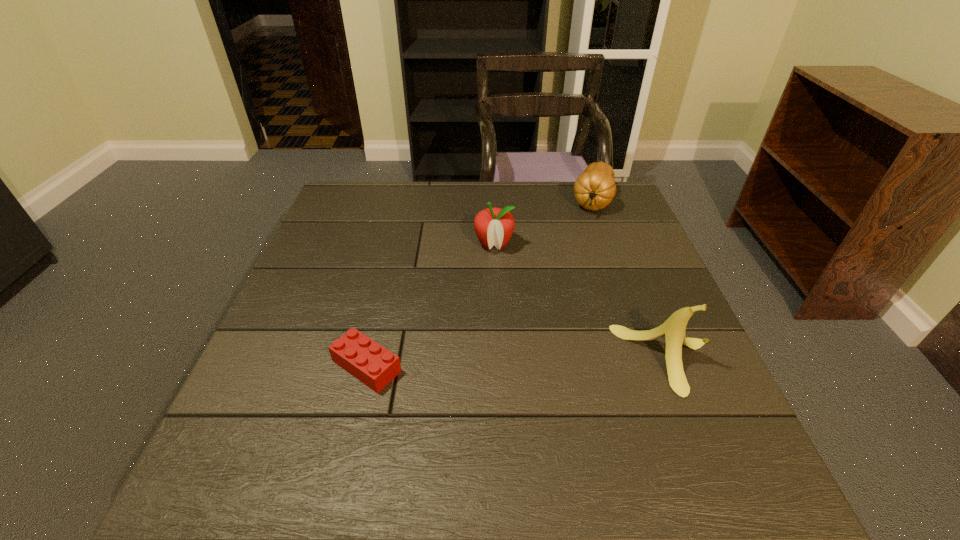
Image resolution: width=960 pixels, height=540 pixels. I want to click on the leftmost object, so click(x=369, y=362).

Find the location of a particular element. The width and height of the screenshot is (960, 540). the shortest object is located at coordinates (369, 362).

Locate an element on the screen. This screenshot has height=540, width=960. the tallest object is located at coordinates 673,329.

The image size is (960, 540). What are the coordinates of `the second object from left to right` in the screenshot? It's located at (494, 226).

This screenshot has width=960, height=540. Identify the location of apple. (494, 226).

Where is `gourd`? Image resolution: width=960 pixels, height=540 pixels. gourd is located at coordinates (594, 189).

What are the coordinates of `vacant space located on the back of the leftmost object` in the screenshot? It's located at (389, 275).

Locate an element on the screen. This screenshot has height=540, width=960. free point located 0.270m on the back of the tallest object is located at coordinates (624, 251).

This screenshot has height=540, width=960. In order to click on free spot located 0.200m on the side where a bite is taken out of the third object from right to left in this screenshot , I will do `click(486, 309)`.

The image size is (960, 540). In order to click on free space located on the side where a bite is taken out of the third object from right to left in this screenshot , I will do `click(486, 309)`.